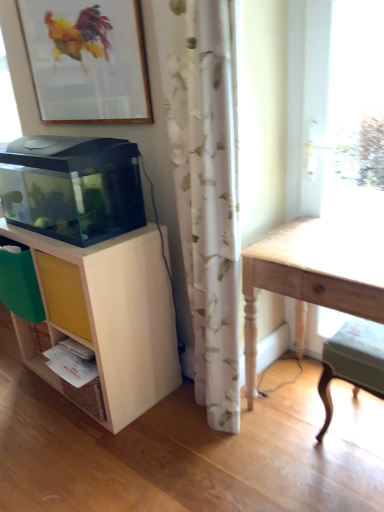
You are a GUI agent. You are given a task and a screenshot of the screen. Output one action in this format:
    pyautogui.click(x=<x>, y=<y>)
    Task: Click on the vacant space that is to the left of light wood table at right
    Image resolution: width=384 pixels, height=512 pixels.
    Given the screenshot: What is the action you would take?
    pyautogui.click(x=214, y=454)